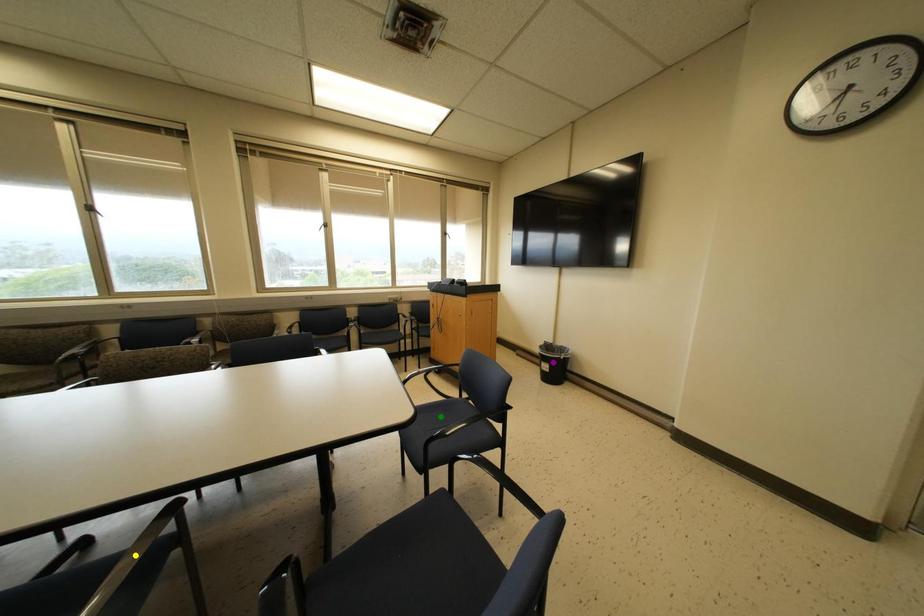
Order these from nearest to farthest:
green point, purple point, yellow point

yellow point → green point → purple point